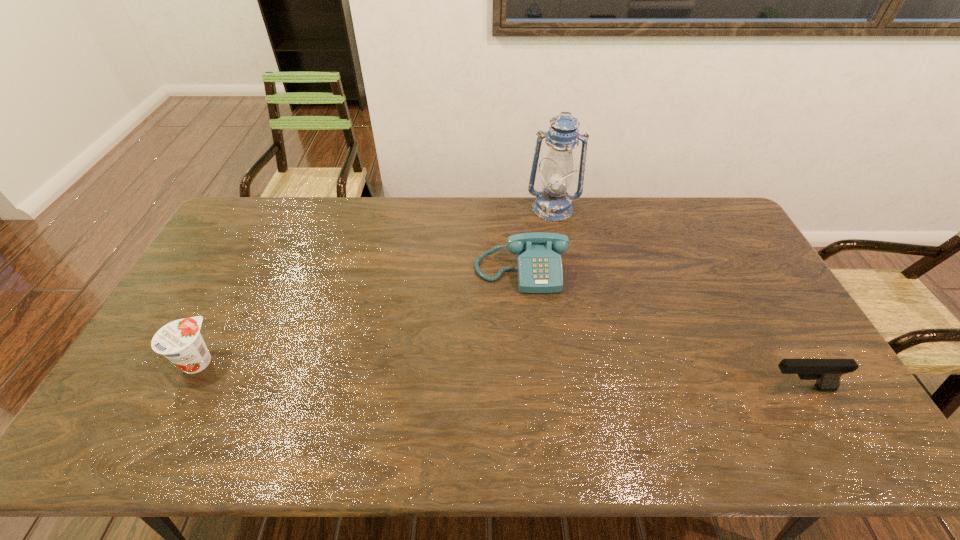
Where is `the third farthest object`? the third farthest object is located at coordinates (180, 341).

Image resolution: width=960 pixels, height=540 pixels. Identify the location of the leftmost object. 180,341.

Image resolution: width=960 pixels, height=540 pixels. I want to click on the rightmost object, so click(x=827, y=372).

Find the location of `pistol`. pistol is located at coordinates pos(827,372).

Where is `telephone`? The height and width of the screenshot is (540, 960). telephone is located at coordinates (539, 266).

Find the location of a particular element. This screenshot has height=540, width=960. lantern is located at coordinates (553, 203).

Find the location of a particular element. Image resolution: width=960 pixels, height=540 pixels. the farthest object is located at coordinates (553, 203).

Find the location of a particular element. vacant space located 0.390m on the back of the third farthest object is located at coordinates (256, 249).

You are a GUI agent. You are given a task and a screenshot of the screen. Output one action in this format:
    pyautogui.click(x=<x>, y=<y>)
    Task: Click on the free space located on the front-facing side of the rightmost object
    The image size is (960, 540).
    Given the screenshot: What is the action you would take?
    pyautogui.click(x=708, y=388)

I want to click on vacant region located on the front-facing side of the rightmost object, so click(727, 388).